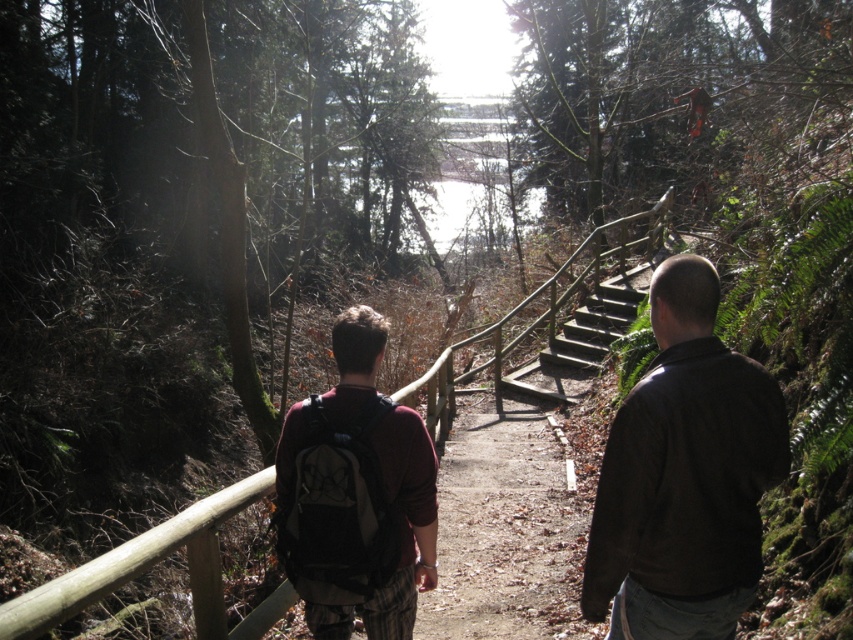
You are a hiker trying to follow the trail to the water. You see the dark brown leather jacket at right and the wooden at center. Which direction should you walk to stay on the trail?

The dark brown leather jacket at right is positioned over wooden at center, so you should walk towards the wooden at center to stay on the trail.

You are a hiker trying to decide which item to place first in your pack. You see the maroon fabric backpack at center and the wooden at center. Which item is narrower?

The maroon fabric backpack at center is narrower than the wooden at center.